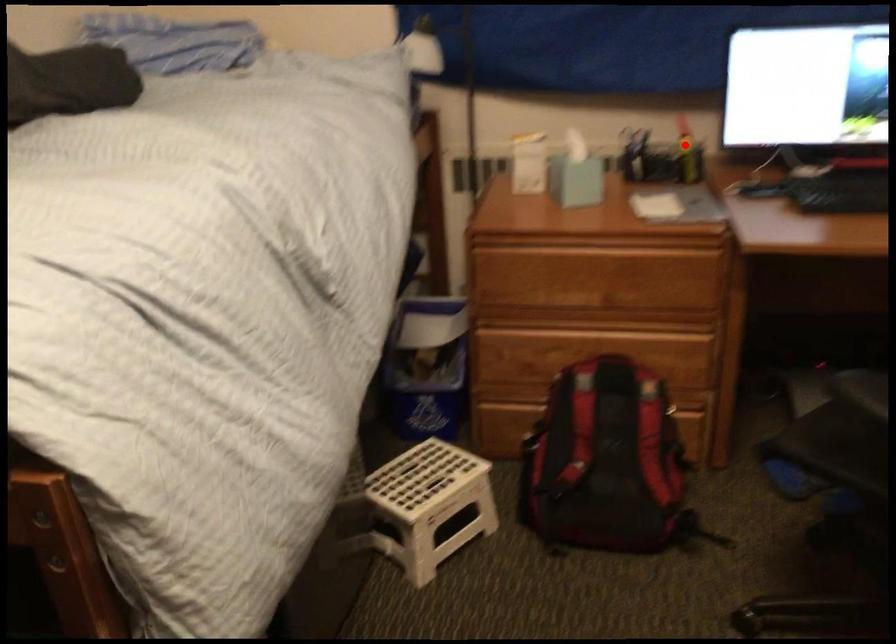
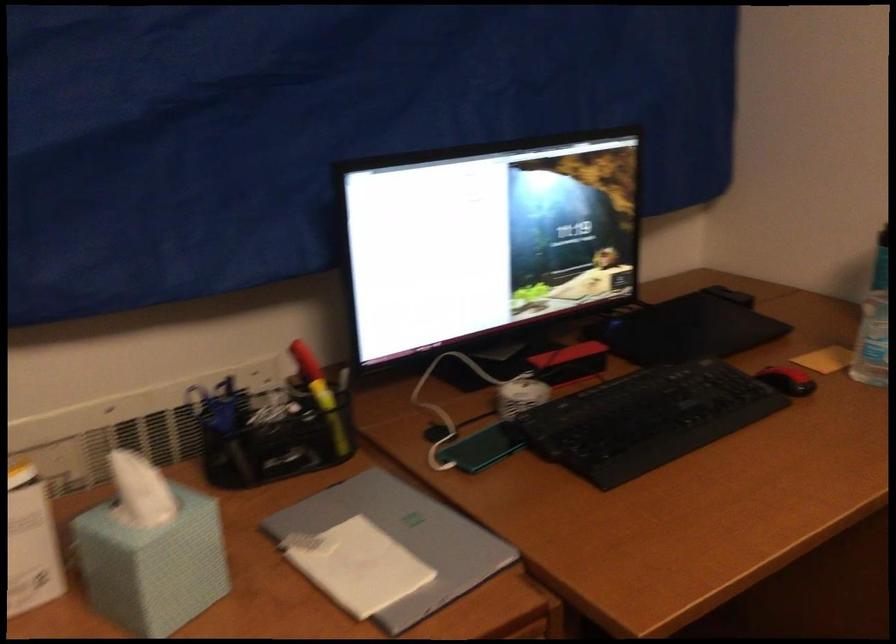
Question: I am providing you with two images of the same scene from different viewpoints. Given a red point in image1, look at the same physical point in image2. Is it:

Choices:
 (A) Closer to the viewpoint
 (B) Farther from the viewpoint

Answer: (A)